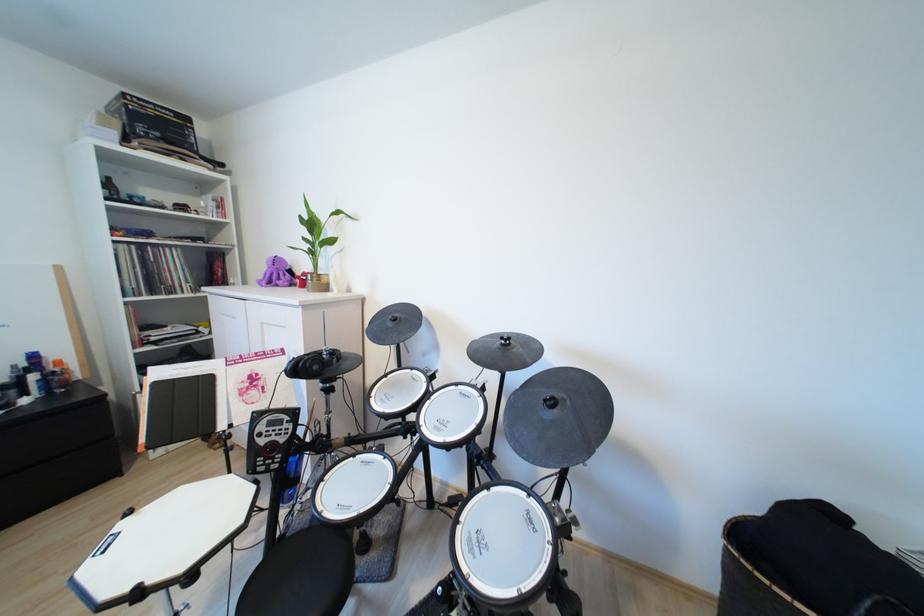
Find the location of a particular element. drum kick pedal is located at coordinates (782, 323).